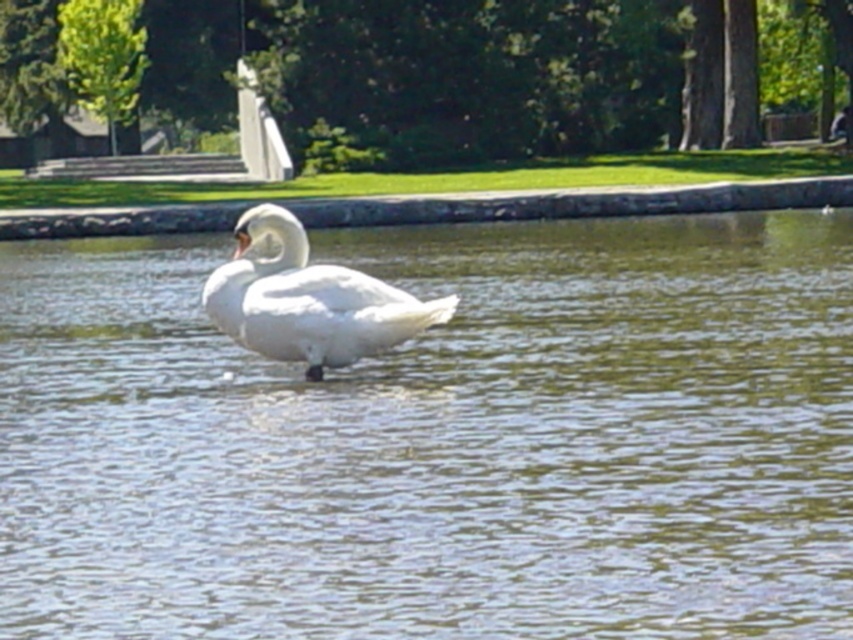
Can you confirm if white feathered swan at center is wider than white smooth swan at center?

Correct, the width of white feathered swan at center exceeds that of white smooth swan at center.

Can you confirm if white feathered swan at center is taller than white smooth swan at center?

Yes, white feathered swan at center is taller than white smooth swan at center.

What do you see at coordinates (471, 72) in the screenshot? Image resolution: width=853 pixels, height=640 pixels. I see `white feathered swan at center` at bounding box center [471, 72].

The width and height of the screenshot is (853, 640). In order to click on white feathered swan at center in this screenshot , I will do pyautogui.click(x=471, y=72).

Who is shorter, clear water at center or white feathered swan at center?

clear water at center is shorter.

Is clear water at center to the left of white feathered swan at center from the viewer's perspective?

No, clear water at center is not to the left of white feathered swan at center.

Where is `clear water at center`? clear water at center is located at coordinates (439, 440).

Is point (782, 410) more distant than point (380, 301)?

No, it is not.

This screenshot has height=640, width=853. Find the location of `clear water at center`. clear water at center is located at coordinates (439, 440).

Is point (601, 620) in front of point (357, 301)?

Yes, it is.

Where is `clear water at center`? clear water at center is located at coordinates (439, 440).